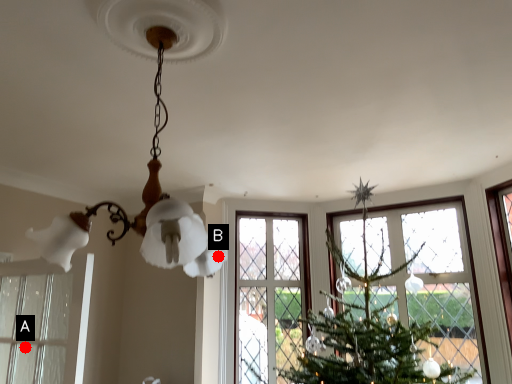
Question: Two points are circled on the image, labeled by A and B beside each circle. Which point is closer to the camera taking this photo?

Choices:
 (A) A is closer
 (B) B is closer

Answer: (B)